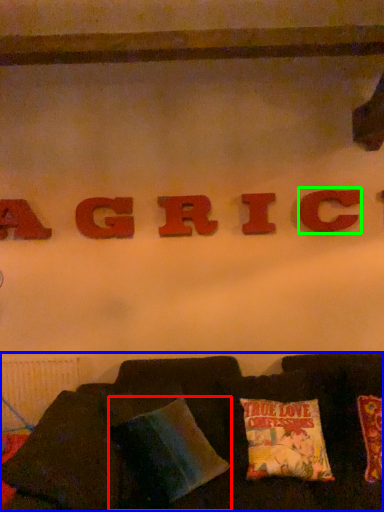
Question: Which object is positioned farthest from pillow (highlighted by a red box)? Select from furniture (highlighted by a blue box) and letter (highlighted by a green box).

Choices:
 (A) furniture
 (B) letter

Answer: (B)